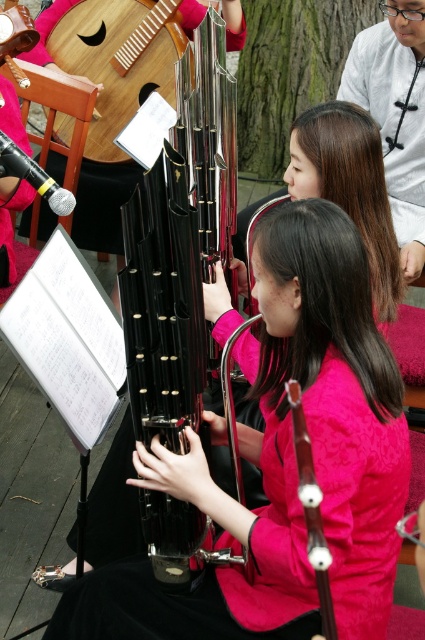
You are standing at the origin point of the coordinate system. The image has a coordinate system where the bottom left corner is the origin. You want to find the matte pink sweater at center. In which direction should you look?

The matte pink sweater at center is located at coordinate point (396, 115). Since the origin is at the bottom left corner, this means it is positioned to the right and slightly above the bottom edge. Therefore, you should look to the right and slightly upward from the bottom left corner to find the matte pink sweater at center.

You are a photographer setting up for a concert photo shoot. You need to position a spotlight so it illuminates both the black glossy bassoon at center and the wooden acoustic guitar at upper left. Given their positions, which instrument should the spotlight be angled downward toward?

The spotlight should be angled downward toward the black glossy bassoon at center because it is positioned under the wooden acoustic guitar at upper left.